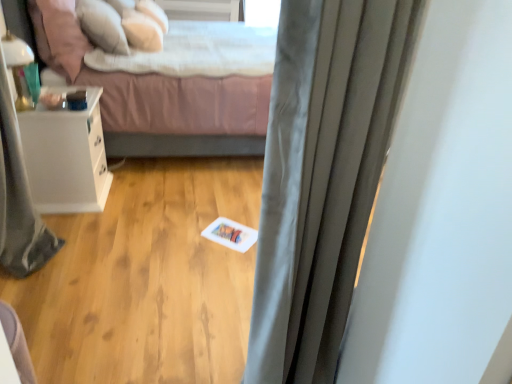
Where is `unoccupied area behind gray fabric shower curtain at left`? The image size is (512, 384). unoccupied area behind gray fabric shower curtain at left is located at coordinates (81, 220).